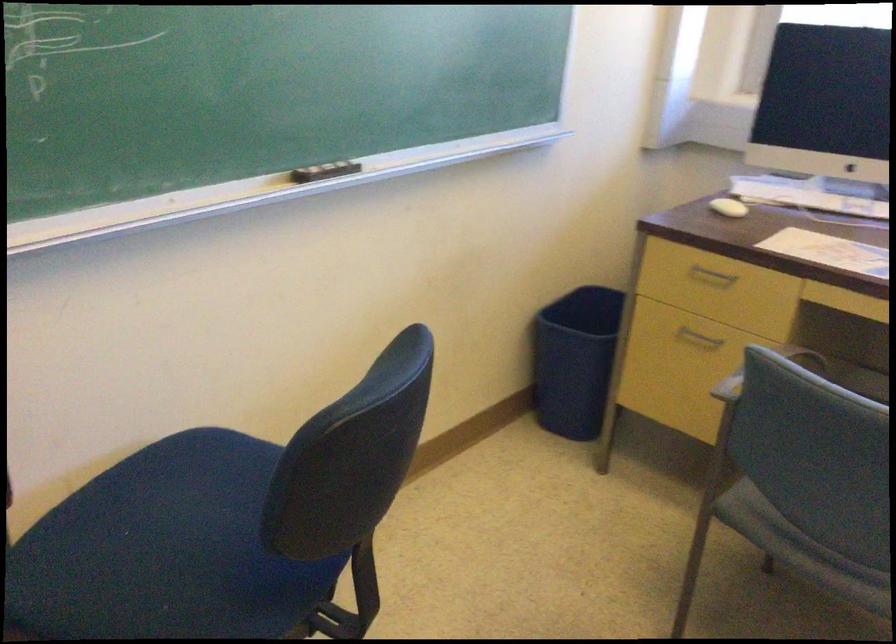
The height and width of the screenshot is (644, 896). What do you see at coordinates (800, 549) in the screenshot?
I see `the grey chair sitting surface` at bounding box center [800, 549].